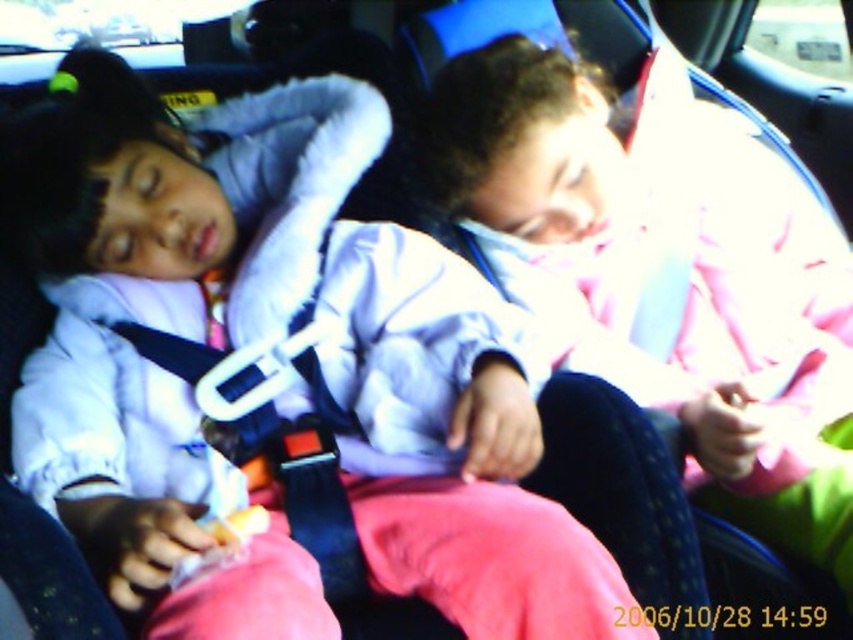
Question: Is white matte shirt at center smaller than pink fabric at center?

Choices:
 (A) no
 (B) yes

Answer: (A)

Question: Which object is farther from the camera taking this photo?

Choices:
 (A) pink fabric at center
 (B) white matte shirt at center

Answer: (A)

Question: Which point appears farthest from the camera in this image?

Choices:
 (A) (573, 304)
 (B) (137, 148)

Answer: (A)

Question: Which point is farther from the camera taking this photo?

Choices:
 (A) (564, 161)
 (B) (398, 330)

Answer: (A)

Question: Is white matte shirt at center to the right of pink fabric at center from the viewer's perspective?

Choices:
 (A) yes
 (B) no

Answer: (B)

Question: Can you confirm if white matte shirt at center is thinner than pink fabric at center?

Choices:
 (A) yes
 (B) no

Answer: (B)